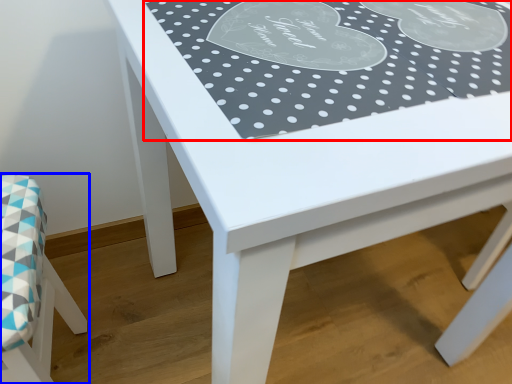
Question: Which object is further to the camera taking this photo, tablecloth (highlighted by a red box) or chair (highlighted by a blue box)?

Choices:
 (A) tablecloth
 (B) chair

Answer: (B)